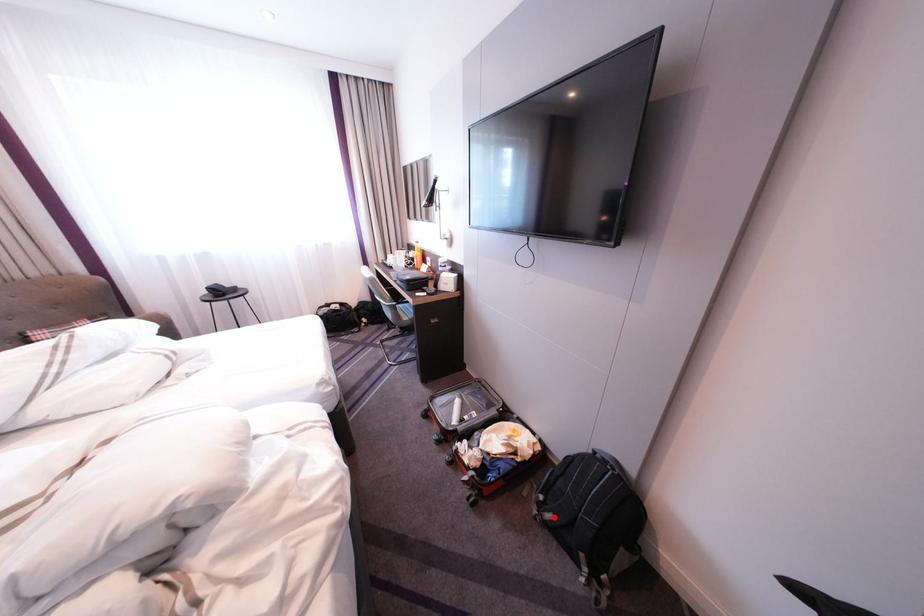
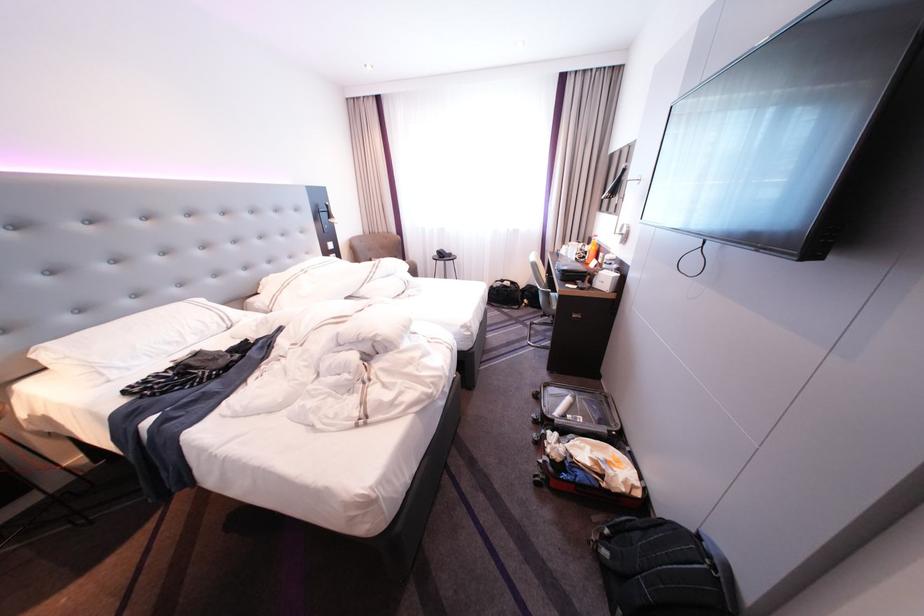
Question: I am providing you with two images of the same scene from different viewpoints. Image1 has a red point marked. In image2, the corresponding 3D location appears at what relative position? Reply with the corresponding letter.

Choices:
 (A) Closer
 (B) Farther

Answer: (A)